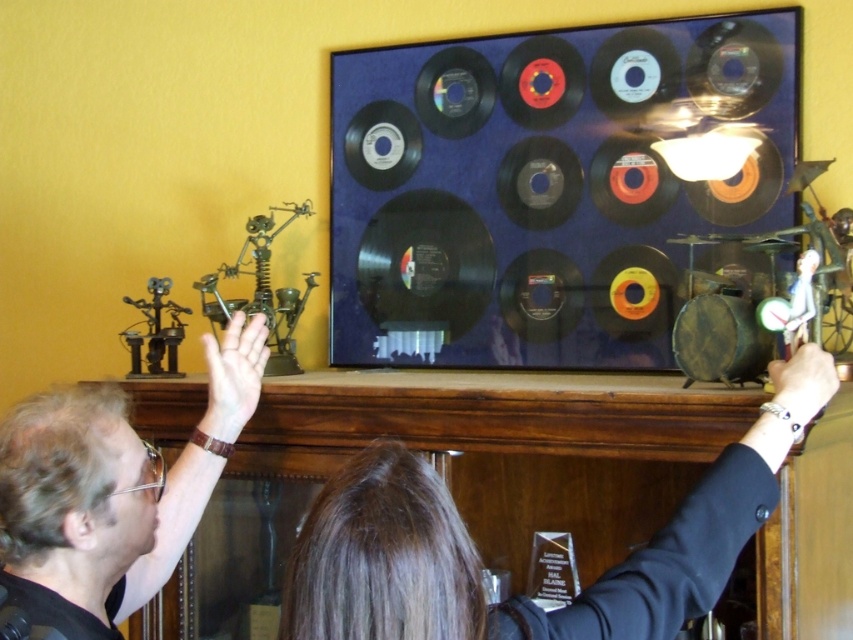
Does brown hair at upper center appear on the left side of matte black shirt at upper left?

No, brown hair at upper center is not to the left of matte black shirt at upper left.

The width and height of the screenshot is (853, 640). I want to click on brown hair at upper center, so click(x=479, y=560).